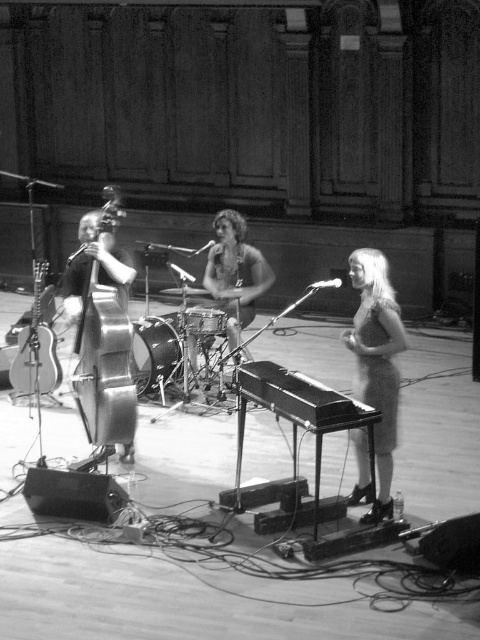
You are standing in the concert hall and want to take a photo of the point at coordinates point (126,280). The camera you have can focus clearly up to 7 meters. Will the camera be able to capture the point in focus?

The distance of point (126,280) from viewer is 7.20 meters, which is beyond the camera focus range of 7 meters. The camera will not be able to capture the point in focus.